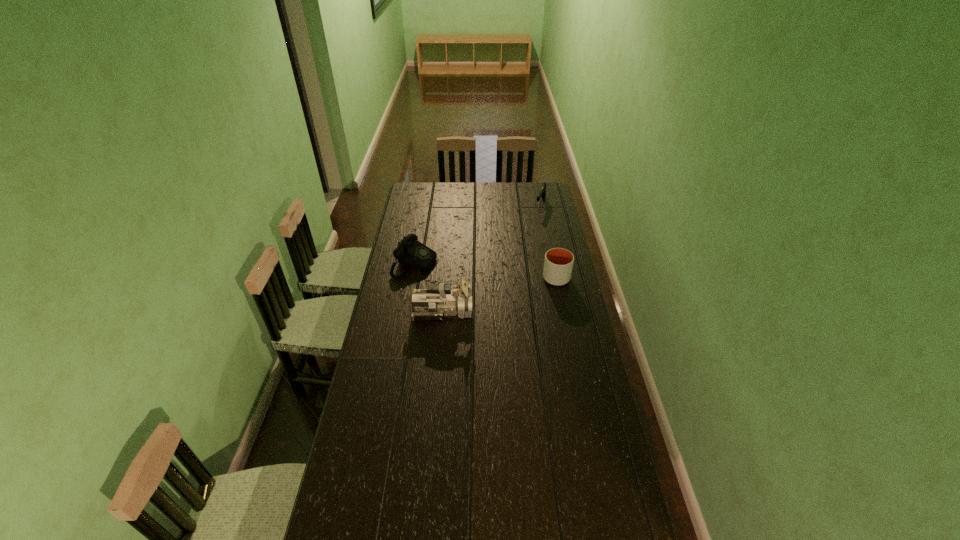
At what (x,y) coordinates should I click in order to perform the action: click on free point located 0.220m on the dial of the telephone. Please return your answer as a coordinate pair (x, y). Image resolution: width=960 pixels, height=540 pixels. Looking at the image, I should click on (475, 281).

This screenshot has height=540, width=960. What are the coordinates of `vacant area situated 0.080m on the dial of the telephone` in the screenshot? It's located at (448, 274).

Locate an element on the screen. The width and height of the screenshot is (960, 540). vacant space located 0.320m on the dial of the telephone is located at coordinates (494, 286).

Find the location of a particular element. object present at the far edge is located at coordinates (542, 193).

Where is `camcorder situated at the left edge`? This screenshot has height=540, width=960. camcorder situated at the left edge is located at coordinates (438, 300).

In order to click on telephone that is positioned at the left edge in this screenshot , I will do `click(410, 252)`.

This screenshot has height=540, width=960. In order to click on cup that is at the right edge in this screenshot , I will do `click(558, 264)`.

This screenshot has width=960, height=540. I want to click on gun that is positioned at the right edge, so click(542, 193).

Find the location of a particular element. object located at the far right corner is located at coordinates (542, 193).

You are a GUI agent. You are given a task and a screenshot of the screen. Output one action in this format:
    pyautogui.click(x=<x>, y=<y>)
    Task: Click on the blank space at the far edge
    This screenshot has height=540, width=960.
    Given the screenshot: What is the action you would take?
    pyautogui.click(x=442, y=190)